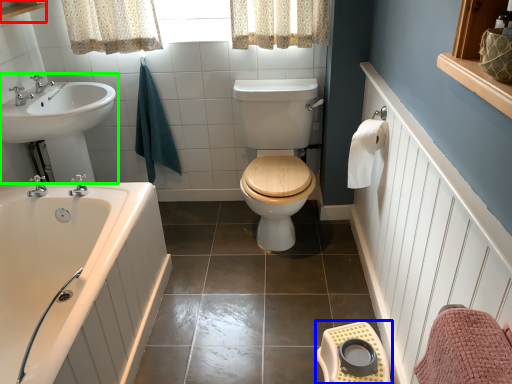
Question: Considering the real-world distances, which object is farthest from balustrade (highlighted by a red box)? step stool (highlighted by a blue box) or sink (highlighted by a green box)?

Choices:
 (A) step stool
 (B) sink

Answer: (A)